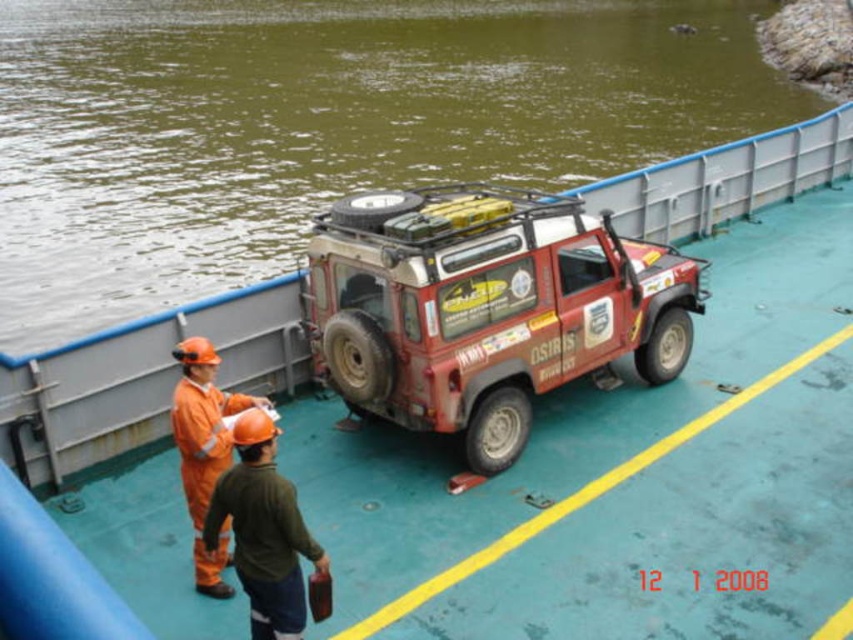
Based on the scene, which object occupies a larger area in the image, the green water at upper left or the rusty metal jeep at center?

The green water at upper left is bigger than the rusty metal jeep at center according to the description.

You are a safety inspector on the ferry deck. You need to determine if the rusty metal jeep at center can pass under a low bridge that has a clearance of 2 meters. The orange hard hat at left is 0.3 meters tall. Can the jeep pass under the bridge?

The rusty metal jeep at center is taller than the orange hard hat at left, which is 0.3 meters tall. Since the jeep is taller than 0.3 meters, but the exact height isn not provided, we cannot definitively determine if it can pass under the 2 meter clearance bridge.